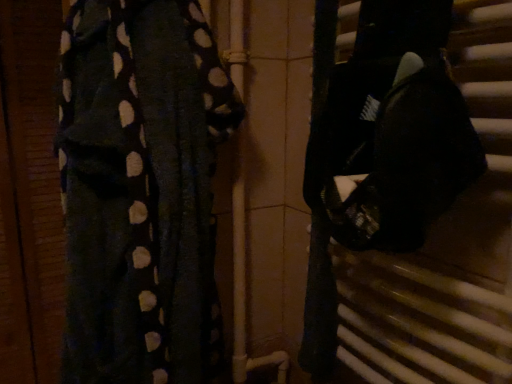
The height and width of the screenshot is (384, 512). What do you see at coordinates (141, 190) in the screenshot? I see `dark blue polka dot scarf at left` at bounding box center [141, 190].

Find the location of a particular element. This screenshot has width=512, height=384. dark blue polka dot scarf at left is located at coordinates (141, 190).

Find the location of a particular element. dark blue polka dot scarf at left is located at coordinates (141, 190).